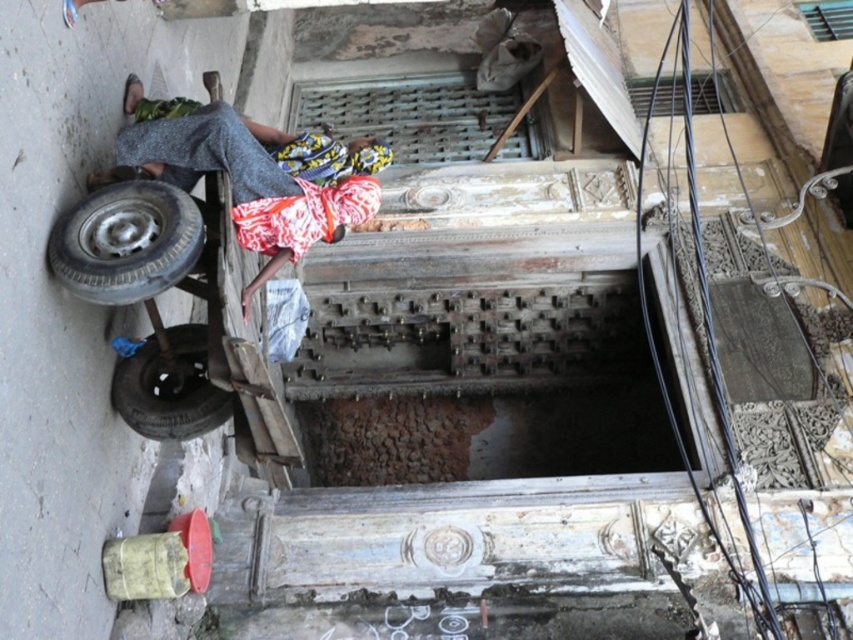
You are a delivery person trying to deliver a package to the address marked by the weathered wooden door with intricate carvings. You have a package that is 40 inches long. Can you fit the package between the printed fabric headscarf at upper center and the black rubber tire at lower left without bending it?

The distance between the printed fabric headscarf at upper center and the black rubber tire at lower left is 38.32 inches. Since the package is 40 inches long, it cannot fit straight between them without bending it.